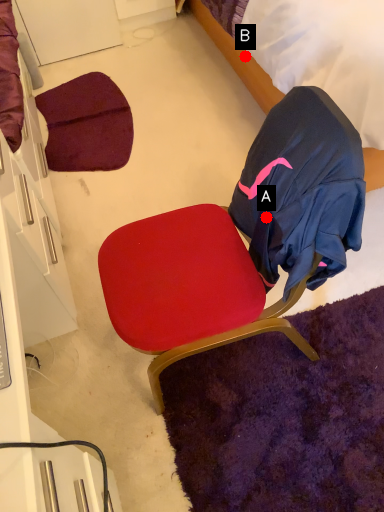
Question: Two points are circled on the image, labeled by A and B beside each circle. Among these points, which one is farthest from the camera?

Choices:
 (A) A is further
 (B) B is further

Answer: (B)